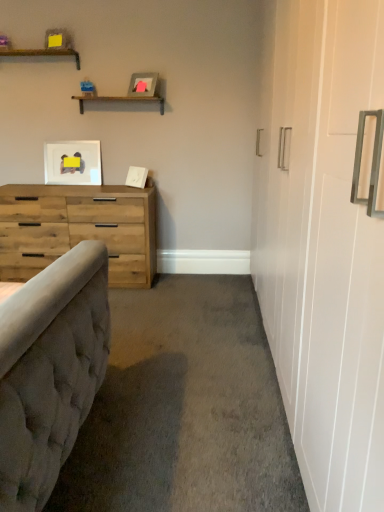
At what (x,y) coordinates should I click in order to perform the action: click on matte gray picture frame at upper center, which is counted as the 1th picture frame, starting from the front. Please return your answer as a coordinate pair (x, y). The image size is (384, 512). Looking at the image, I should click on (143, 84).

Locate an element on the screen. Image resolution: width=384 pixels, height=512 pixels. wooden shelf at upper center, which is counted as the 1th shelf, starting from the bottom is located at coordinates (118, 100).

Is matte gray picture frame at upper center, the second picture frame when ordered from bottom to top, situated inside wooden shelf at upper center, arranged as the 2th shelf when viewed from the top, or outside?

The correct answer is: outside.

Between matte gray picture frame at upper center, the first picture frame from the top, and wooden shelf at upper center, arranged as the 2th shelf when viewed from the top, which one appears on the right side from the viewer's perspective?

From the viewer's perspective, matte gray picture frame at upper center, the first picture frame from the top, appears more on the right side.

From the image's perspective, which is below, matte gray picture frame at upper center, which is counted as the 1th picture frame, starting from the front, or wooden shelf at upper center, arranged as the 2th shelf when viewed from the top?

From the image's view, wooden shelf at upper center, arranged as the 2th shelf when viewed from the top, is below.

From a real-world perspective, is matte gray picture frame at upper center, the second picture frame when ordered from left to right, physically located above or below wooden shelf at upper center, which is the 2th shelf in left-to-right order?

matte gray picture frame at upper center, the second picture frame when ordered from left to right, is above wooden shelf at upper center, which is the 2th shelf in left-to-right order.

From a real-world perspective, which is physically below, matte white picture frame at upper left, acting as the second picture frame starting from the front, or wooden shelf at upper left, which is the first shelf in top-to-bottom order?

From a 3D spatial view, matte white picture frame at upper left, acting as the second picture frame starting from the front, is below.

Locate an element on the screen. shelf on the left of matte white picture frame at upper left, arranged as the 1th picture frame when ordered from the bottom is located at coordinates (42, 53).

Is matte white picture frame at upper left, acting as the second picture frame starting from the front, taller than wooden shelf at upper left, acting as the second shelf starting from the bottom?

Yes.

Who is taller, wooden shelf at upper left, which is the 2th shelf in right-to-left order, or matte gray picture frame at upper center, the first picture frame from the top?

With more height is matte gray picture frame at upper center, the first picture frame from the top.

Considering the relative sizes of wooden shelf at upper left, acting as the second shelf starting from the bottom, and matte gray picture frame at upper center, which is counted as the 1th picture frame, starting from the front, in the image provided, is wooden shelf at upper left, acting as the second shelf starting from the bottom, bigger than matte gray picture frame at upper center, which is counted as the 1th picture frame, starting from the front,?

Yes, wooden shelf at upper left, acting as the second shelf starting from the bottom, is bigger than matte gray picture frame at upper center, which is counted as the 1th picture frame, starting from the front.

Which is closer to the camera, (49,49) or (141,78)?

Point (49,49) appears to be closer to the viewer than point (141,78).

Based on the photo, from the image's perspective, between wooden shelf at upper center, which is the 2th shelf in left-to-right order, and matte gray picture frame at upper center, which is counted as the 1th picture frame, starting from the front, who is located below?

wooden shelf at upper center, which is the 2th shelf in left-to-right order, is shown below in the image.

Between wooden shelf at upper center, which is the 2th shelf in left-to-right order, and matte gray picture frame at upper center, which is counted as the 1th picture frame, starting from the front, which one is positioned behind?

wooden shelf at upper center, which is the 2th shelf in left-to-right order, is behind.

Between wooden shelf at upper center, arranged as the 2th shelf when viewed from the top, and matte gray picture frame at upper center, the first picture frame from the top, which one appears on the left side from the viewer's perspective?

wooden shelf at upper center, arranged as the 2th shelf when viewed from the top.

In the scene shown: From a real-world perspective, is wooden shelf at upper center, which is counted as the 1th shelf, starting from the bottom, physically above matte gray picture frame at upper center, which is counted as the 1th picture frame, starting from the front?

No, from a real-world perspective, wooden shelf at upper center, which is counted as the 1th shelf, starting from the bottom, is not above matte gray picture frame at upper center, which is counted as the 1th picture frame, starting from the front.

Considering the positions of objects matte white picture frame at upper left, acting as the second picture frame starting from the right, and wooden shelf at upper center, which is the first shelf from right to left, in the image provided, who is behind, matte white picture frame at upper left, acting as the second picture frame starting from the right, or wooden shelf at upper center, which is the first shelf from right to left,?

matte white picture frame at upper left, acting as the second picture frame starting from the right, is further away from the camera.

Between point (44, 153) and point (160, 112), which one is positioned behind?

The point (44, 153) is more distant.

From a real-world perspective, is matte white picture frame at upper left, placed as the first picture frame when sorted from left to right, beneath wooden shelf at upper center, arranged as the 2th shelf when viewed from the top?

Yes.

Is matte white picture frame at upper left, arranged as the 1th picture frame when ordered from the bottom, turned away from wooden shelf at upper center, arranged as the 2th shelf when viewed from the top?

No, wooden shelf at upper center, arranged as the 2th shelf when viewed from the top, is not at the back of matte white picture frame at upper left, arranged as the 1th picture frame when ordered from the bottom.

Considering the sizes of objects wooden shelf at upper center, which is the first shelf from right to left, and natural wood dresser at left in the image provided, who is bigger, wooden shelf at upper center, which is the first shelf from right to left, or natural wood dresser at left?

natural wood dresser at left is bigger.

Is natural wood dresser at left completely or partially inside wooden shelf at upper center, which is counted as the 1th shelf, starting from the bottom?

No, natural wood dresser at left is not a part of wooden shelf at upper center, which is counted as the 1th shelf, starting from the bottom.

In the scene shown: Considering the sizes of wooden shelf at upper center, which is counted as the 1th shelf, starting from the bottom, and natural wood dresser at left in the image, is wooden shelf at upper center, which is counted as the 1th shelf, starting from the bottom, wider or thinner than natural wood dresser at left?

Considering their sizes, wooden shelf at upper center, which is counted as the 1th shelf, starting from the bottom, looks slimmer than natural wood dresser at left.

Which of these two, wooden shelf at upper center, which is counted as the 1th shelf, starting from the bottom, or natural wood dresser at left, stands shorter?

Standing shorter between the two is wooden shelf at upper center, which is counted as the 1th shelf, starting from the bottom.

Is natural wood dresser at left looking in the opposite direction of wooden shelf at upper center, which is the 2th shelf in left-to-right order?

No, natural wood dresser at left is not facing the opposite direction of wooden shelf at upper center, which is the 2th shelf in left-to-right order.

Visually, is natural wood dresser at left positioned to the left or to the right of wooden shelf at upper center, which is the 2th shelf in left-to-right order?

From the image, it's evident that natural wood dresser at left is to the left of wooden shelf at upper center, which is the 2th shelf in left-to-right order.

Is natural wood dresser at left outside of wooden shelf at upper center, which is counted as the 1th shelf, starting from the bottom?

Yes, natural wood dresser at left is outside of wooden shelf at upper center, which is counted as the 1th shelf, starting from the bottom.

Locate an element on the screen. This screenshot has width=384, height=512. picture frame above the wooden shelf at upper center, which is the 2th shelf in left-to-right order (from a real-world perspective) is located at coordinates (143, 84).

Where is `the 2nd picture frame behind the wooden shelf at upper left, which is the first shelf in top-to-bottom order, counting from the anchor's position`? The height and width of the screenshot is (512, 384). the 2nd picture frame behind the wooden shelf at upper left, which is the first shelf in top-to-bottom order, counting from the anchor's position is located at coordinates (73, 163).

Estimate the real-world distances between objects in this image. Which object is further from matte gray picture frame at upper center, the second picture frame when ordered from bottom to top, wooden shelf at upper center, which is counted as the 1th shelf, starting from the bottom, or wooden shelf at upper left, acting as the second shelf starting from the bottom?

The object further to matte gray picture frame at upper center, the second picture frame when ordered from bottom to top, is wooden shelf at upper left, acting as the second shelf starting from the bottom.

Which object lies nearer to the anchor point wooden shelf at upper left, the 1th shelf viewed from the left, wooden shelf at upper center, which is the first shelf from right to left, or matte gray picture frame at upper center, the second picture frame when ordered from left to right?

wooden shelf at upper center, which is the first shelf from right to left, is positioned closer to the anchor wooden shelf at upper left, the 1th shelf viewed from the left.

From the image, which object appears to be farther from wooden shelf at upper center, which is counted as the 1th shelf, starting from the bottom, matte gray picture frame at upper center, the 2th picture frame positioned from the back, or natural wood dresser at left?

The object further to wooden shelf at upper center, which is counted as the 1th shelf, starting from the bottom, is natural wood dresser at left.

Which object lies further to the anchor point wooden shelf at upper left, which is the 2th shelf in right-to-left order, wooden shelf at upper center, arranged as the 2th shelf when viewed from the top, or matte white picture frame at upper left, acting as the second picture frame starting from the front?

matte white picture frame at upper left, acting as the second picture frame starting from the front, is further to wooden shelf at upper left, which is the 2th shelf in right-to-left order.

Which object lies nearer to the anchor point natural wood dresser at left, matte gray picture frame at upper center, the first picture frame from the top, or wooden shelf at upper center, which is the 2th shelf in left-to-right order?

Among the two, wooden shelf at upper center, which is the 2th shelf in left-to-right order, is located nearer to natural wood dresser at left.

Estimate the real-world distances between objects in this image. Which object is further from matte gray picture frame at upper center, the second picture frame when ordered from left to right, matte white picture frame at upper left, arranged as the 1th picture frame when ordered from the bottom, or wooden shelf at upper left, acting as the second shelf starting from the bottom?

matte white picture frame at upper left, arranged as the 1th picture frame when ordered from the bottom, is further to matte gray picture frame at upper center, the second picture frame when ordered from left to right.

Based on their spatial positions, is matte white picture frame at upper left, acting as the second picture frame starting from the front, or natural wood dresser at left closer to wooden shelf at upper left, the 1th shelf viewed from the left?

matte white picture frame at upper left, acting as the second picture frame starting from the front, lies closer to wooden shelf at upper left, the 1th shelf viewed from the left, than the other object.

From the image, which object appears to be farther from wooden shelf at upper center, which is the first shelf from right to left, wooden shelf at upper left, which is the 2th shelf in right-to-left order, or natural wood dresser at left?

natural wood dresser at left is further to wooden shelf at upper center, which is the first shelf from right to left.

Identify the location of shelf between wooden shelf at upper left, which is the first shelf in top-to-bottom order, and matte white picture frame at upper left, arranged as the 1th picture frame when ordered from the bottom, vertically. (118, 100).

Find the location of a particular element. shelf between matte white picture frame at upper left, the 1th picture frame from the back, and matte gray picture frame at upper center, which is counted as the 1th picture frame, starting from the front, in the horizontal direction is located at coordinates (118, 100).

At what (x,y) coordinates should I click in order to perform the action: click on picture frame between matte gray picture frame at upper center, the 1th picture frame in the right-to-left sequence, and natural wood dresser at left from top to bottom. Please return your answer as a coordinate pair (x, y). Looking at the image, I should click on (73, 163).

Identify the location of shelf situated between wooden shelf at upper left, acting as the second shelf starting from the bottom, and matte gray picture frame at upper center, the second picture frame when ordered from left to right, from left to right. This screenshot has height=512, width=384. (118, 100).